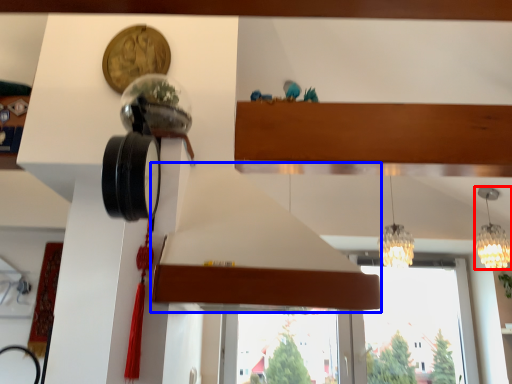
Question: Which point is closer to the camera, lamp (highlighted by a red box) or exhaust hood (highlighted by a blue box)?

Choices:
 (A) lamp
 (B) exhaust hood

Answer: (B)